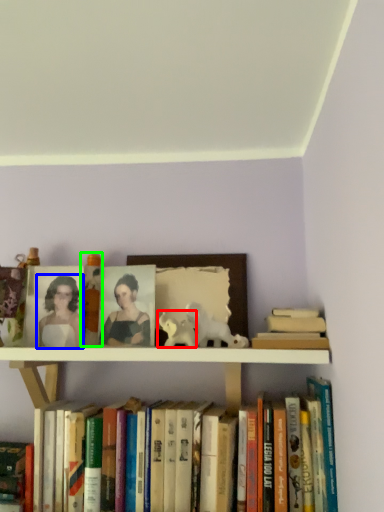
Question: Considering the real-world distances, which object is farthest from animal (highlighted by a red box)? woman (highlighted by a blue box) or toy (highlighted by a green box)?

Choices:
 (A) woman
 (B) toy

Answer: (A)